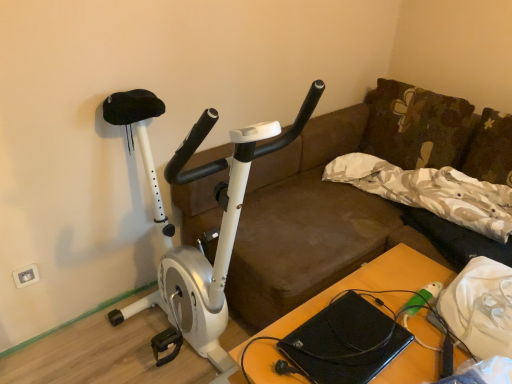
What are the coordinates of `vacant point to the right of black matte laptop at lower center` in the screenshot? It's located at (408, 329).